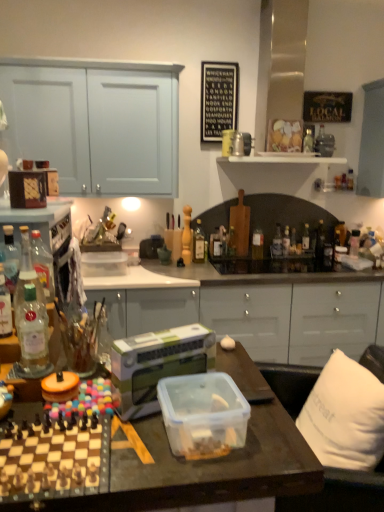
Identify the location of free point in front of translucent glass bottle at center, placed as the seventh bottle when sorted from left to right. The width and height of the screenshot is (384, 512). (257, 265).